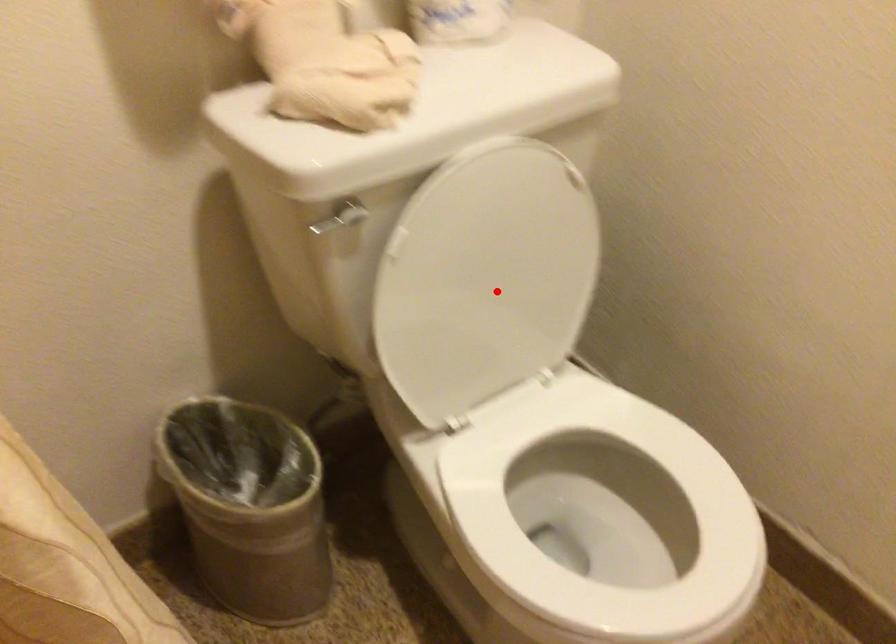
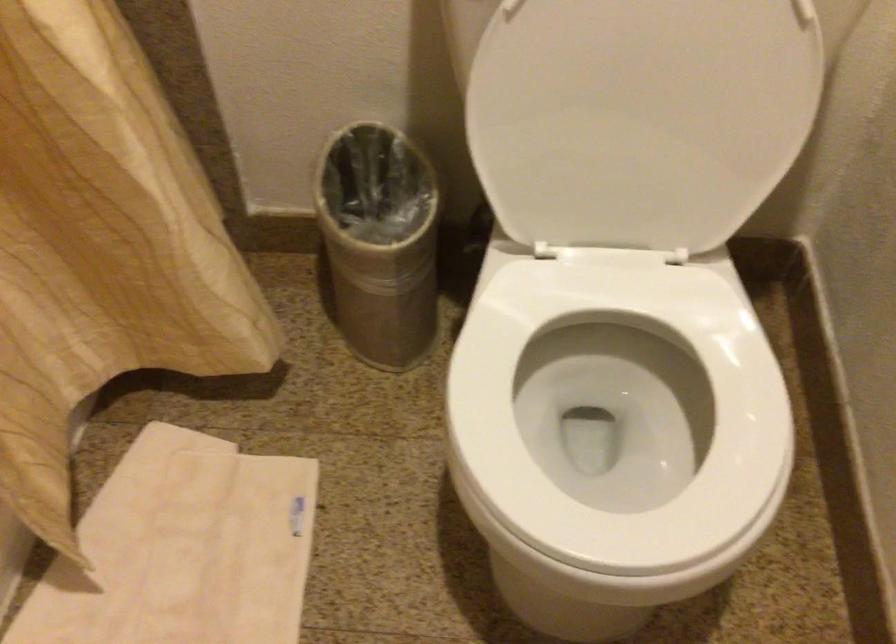
Question: I am providing you with two images of the same scene from different viewpoints. Given a red point in image1, look at the same physical point in image2. Is it:

Choices:
 (A) Closer to the viewpoint
 (B) Farther from the viewpoint

Answer: (A)